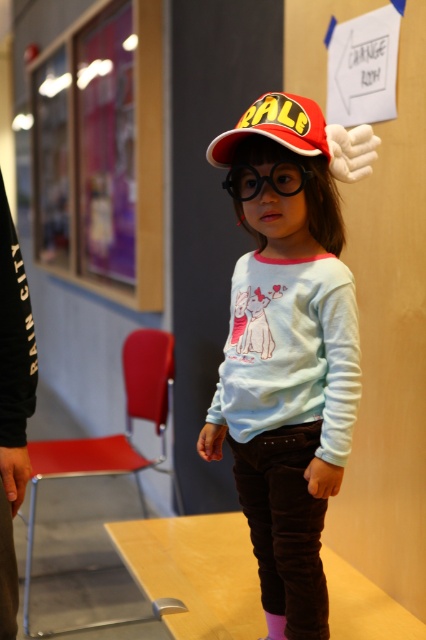
You are a fashion designer who wants to place a new accessory on the black cotton sweatshirt at left. According to the image, where exactly should you place it?

The black cotton sweatshirt at left is located at point [13,404], so you should place the accessory at that coordinate.

The child is wearing a red baseball cap with wings and oversized black glasses. There is also a point marked at coordinates (265, 179). What object is located at that point?

The point at coordinates (265, 179) corresponds to black plastic goggles at center.

You are a toy designer observing the child in the image. You need to determine which item is closer to the child for packaging purposes. Which is closer to the child between the black plastic goggles at center and the white soft sock at lower center?

The black plastic goggles at center is closer to the viewer than the white soft sock at lower center, so the goggles are closer to the child.